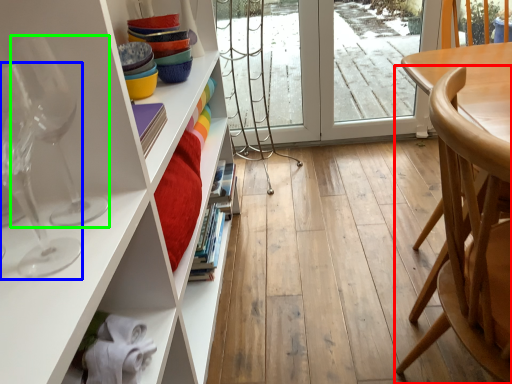
Question: Estimate the real-world distances between objects in this image. Which object is closer to chair (highlighted by a red box), wine glass (highlighted by a blue box) or wine glass (highlighted by a green box)?

Choices:
 (A) wine glass
 (B) wine glass

Answer: (B)